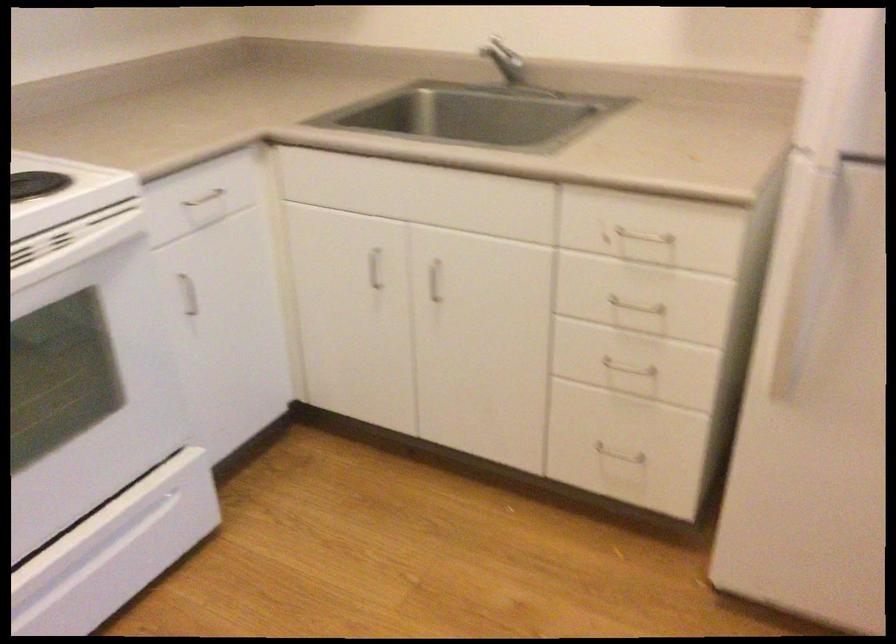
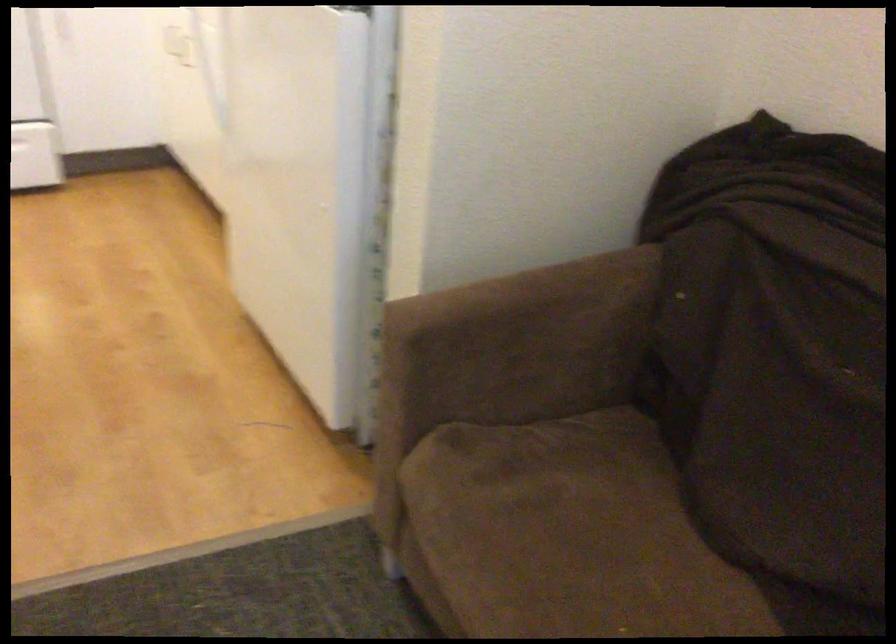
Question: I am providing you with two images of the same scene from different viewpoints. Which of the following objects are not visible in image2?

Choices:
 (A) metal pull handle
 (B) sofa sitting surface
 (C) blue clipboard
 (D) brown sofa armrest

Answer: (A)